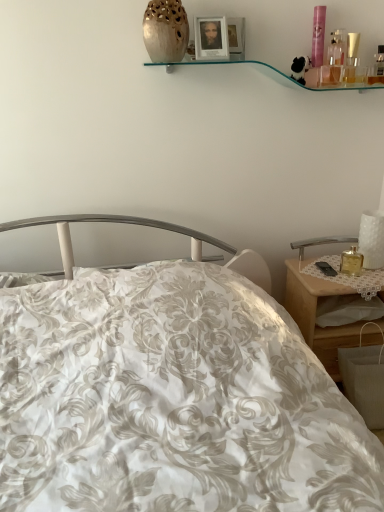
Question: Is matte beige vase at upper center outside of wooden nightstand at right?

Choices:
 (A) no
 (B) yes

Answer: (B)

Question: Does matte beige vase at upper center have a lesser height compared to wooden nightstand at right?

Choices:
 (A) yes
 (B) no

Answer: (A)

Question: From a real-world perspective, is matte beige vase at upper center beneath wooden nightstand at right?

Choices:
 (A) yes
 (B) no

Answer: (B)

Question: Is there a large distance between matte beige vase at upper center and wooden nightstand at right?

Choices:
 (A) yes
 (B) no

Answer: (A)

Question: Does matte beige vase at upper center have a greater height compared to wooden nightstand at right?

Choices:
 (A) no
 (B) yes

Answer: (A)

Question: Based on their sizes in the image, would you say wooden nightstand at right is bigger or smaller than matte beige vase at upper center?

Choices:
 (A) big
 (B) small

Answer: (A)

Question: In the image, is wooden nightstand at right positioned in front of or behind matte beige vase at upper center?

Choices:
 (A) front
 (B) behind

Answer: (B)

Question: Considering the positions of wooden nightstand at right and matte beige vase at upper center in the image, is wooden nightstand at right taller or shorter than matte beige vase at upper center?

Choices:
 (A) tall
 (B) short

Answer: (A)

Question: Looking at their shapes, would you say wooden nightstand at right is wider or thinner than matte beige vase at upper center?

Choices:
 (A) wide
 (B) thin

Answer: (A)

Question: In the image, is matte wooden picture frame at upper center on the left side or the right side of matte beige vase at upper center?

Choices:
 (A) right
 (B) left

Answer: (A)

Question: From a real-world perspective, is matte wooden picture frame at upper center physically located above or below matte beige vase at upper center?

Choices:
 (A) above
 (B) below

Answer: (B)

Question: Considering the positions of point (208, 26) and point (162, 57), is point (208, 26) closer or farther from the camera than point (162, 57)?

Choices:
 (A) farther
 (B) closer

Answer: (A)

Question: Do you think matte wooden picture frame at upper center is within matte beige vase at upper center, or outside of it?

Choices:
 (A) inside
 (B) outside

Answer: (B)

Question: Is matte wooden picture frame at upper center situated inside wooden nightstand at right or outside?

Choices:
 (A) outside
 (B) inside

Answer: (A)

Question: Considering the positions of point (198, 54) and point (327, 349), is point (198, 54) closer or farther from the camera than point (327, 349)?

Choices:
 (A) farther
 (B) closer

Answer: (B)